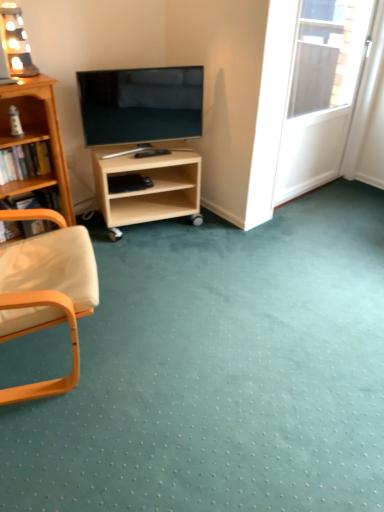
Find the location of a particular element. The width and height of the screenshot is (384, 512). vacant space that's between wooden armchair at left and light wood/unfinishedobject at center is located at coordinates (150, 275).